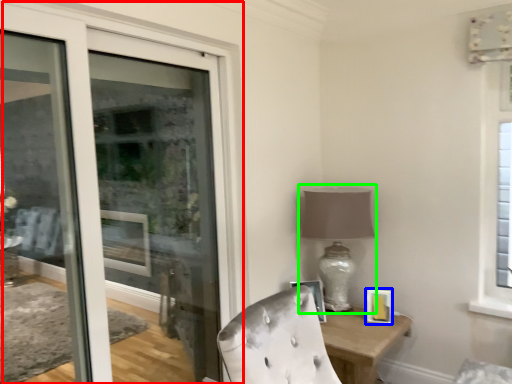
Question: Estimate the real-world distances between objects in this image. Which object is closer to door (highlighted by a red box), picture frame (highlighted by a blue box) or table lamp (highlighted by a green box)?

Choices:
 (A) picture frame
 (B) table lamp

Answer: (B)